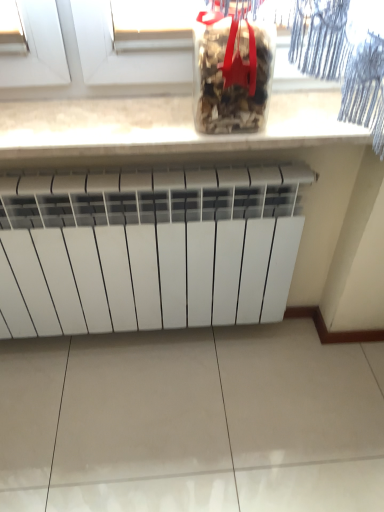
Question: Is transparent plastic container at upper center positioned beyond the bounds of white stone countertop at upper center?

Choices:
 (A) yes
 (B) no

Answer: (A)

Question: Does transparent plastic container at upper center have a greater width compared to white stone countertop at upper center?

Choices:
 (A) no
 (B) yes

Answer: (A)

Question: From the image's perspective, is transparent plastic container at upper center over white stone countertop at upper center?

Choices:
 (A) no
 (B) yes

Answer: (B)

Question: Is transparent plastic container at upper center turned away from white stone countertop at upper center?

Choices:
 (A) no
 (B) yes

Answer: (A)

Question: Is white stone countertop at upper center completely or partially inside transparent plastic container at upper center?

Choices:
 (A) no
 (B) yes

Answer: (A)

Question: From a real-world perspective, relative to white stone countertop at upper center, is transparent plastic container at upper center vertically above or below?

Choices:
 (A) below
 (B) above

Answer: (B)

Question: Do you think transparent plastic container at upper center is within white stone countertop at upper center, or outside of it?

Choices:
 (A) inside
 (B) outside

Answer: (B)

Question: Is transparent plastic container at upper center bigger or smaller than white stone countertop at upper center?

Choices:
 (A) big
 (B) small

Answer: (B)

Question: Is transparent plastic container at upper center taller or shorter than white stone countertop at upper center?

Choices:
 (A) tall
 (B) short

Answer: (A)

Question: Is point (140, 314) closer or farther from the camera than point (238, 91)?

Choices:
 (A) farther
 (B) closer

Answer: (A)

Question: Relative to transparent plastic container at upper center, is white matte radiator at center in front or behind?

Choices:
 (A) behind
 (B) front

Answer: (A)

Question: Is white matte radiator at center wider or thinner than transparent plastic container at upper center?

Choices:
 (A) thin
 (B) wide

Answer: (B)

Question: Is white matte radiator at center to the left or to the right of transparent plastic container at upper center in the image?

Choices:
 (A) left
 (B) right

Answer: (A)

Question: Is white stone countertop at upper center in front of or behind transparent plastic container at upper center in the image?

Choices:
 (A) behind
 (B) front

Answer: (A)

Question: Would you say white stone countertop at upper center is inside or outside transparent plastic container at upper center?

Choices:
 (A) inside
 (B) outside

Answer: (B)